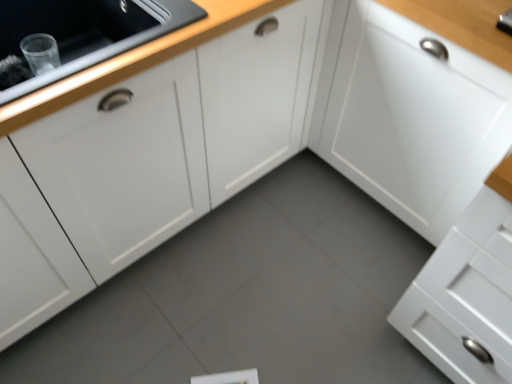
Question: From a real-world perspective, is white matte cabinet at upper right, the second cabinetry in the left-to-right sequence, above or below white matte cabinet at left, the 2th cabinetry viewed from the right?

Choices:
 (A) below
 (B) above

Answer: (A)

Question: In the image, is white matte cabinet at upper right, the second cabinetry in the left-to-right sequence, positioned in front of or behind white matte cabinet at left, the 2th cabinetry viewed from the right?

Choices:
 (A) front
 (B) behind

Answer: (B)

Question: Considering the positions of white matte cabinet at upper right, the second cabinetry in the left-to-right sequence, and white matte cabinet at left, the 2th cabinetry viewed from the right, in the image, is white matte cabinet at upper right, the second cabinetry in the left-to-right sequence, bigger or smaller than white matte cabinet at left, the 2th cabinetry viewed from the right,?

Choices:
 (A) small
 (B) big

Answer: (B)

Question: Do you think white matte cabinet at left, which is the first cabinetry in left-to-right order, is within white matte cabinet at upper right, the second cabinetry in the left-to-right sequence, or outside of it?

Choices:
 (A) outside
 (B) inside

Answer: (A)

Question: Is white matte cabinet at left, the 2th cabinetry viewed from the right, in front of or behind white matte cabinet at upper right, which ranks as the first cabinetry in right-to-left order, in the image?

Choices:
 (A) front
 (B) behind

Answer: (A)

Question: Does point (38, 147) appear closer or farther from the camera than point (362, 142)?

Choices:
 (A) farther
 (B) closer

Answer: (B)

Question: From the image's perspective, is white matte cabinet at left, which is the first cabinetry in left-to-right order, positioned above or below white matte cabinet at upper right, the second cabinetry in the left-to-right sequence?

Choices:
 (A) above
 (B) below

Answer: (A)